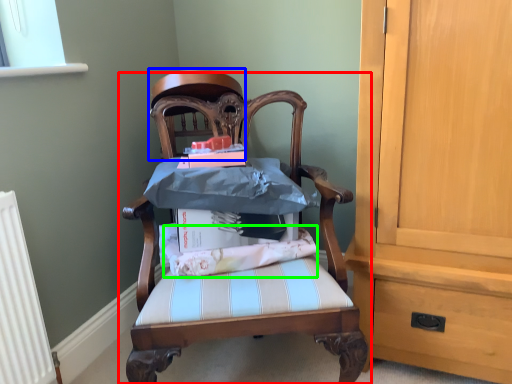
Question: Considering the real-world distances, which object is closest to chair (highlighted by a red box)? chair (highlighted by a blue box) or fabric (highlighted by a green box).

Choices:
 (A) chair
 (B) fabric

Answer: (B)